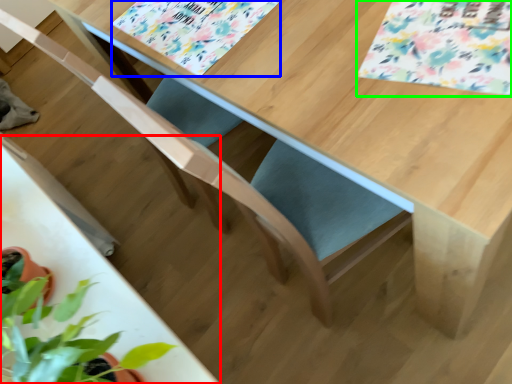
Question: Which is nearer to the round table (highlighted by a red box)? flower (highlighted by a blue box) or flower (highlighted by a green box).

Choices:
 (A) flower
 (B) flower

Answer: (A)